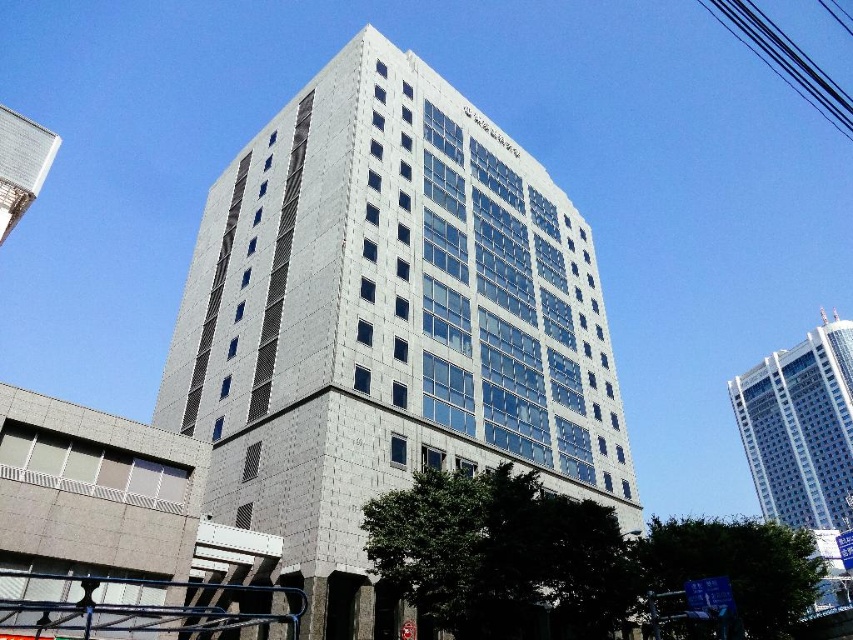
Does white glass building at upper right have a greater width compared to metallic silver tower at upper left?

Yes, white glass building at upper right is wider than metallic silver tower at upper left.

Who is more forward, (834, 358) or (39, 157)?

Point (39, 157)

Locate an element on the screen. This screenshot has height=640, width=853. white glass building at upper right is located at coordinates (804, 442).

Between white glass building at center and metallic silver tower at upper left, which one has more height?

white glass building at center is taller.

Between white glass building at center and metallic silver tower at upper left, which one is positioned lower?

white glass building at center is lower down.

Is point (233, 259) farther from viewer compared to point (38, 163)?

Yes, point (233, 259) is farther from viewer.

Locate an element on the screen. The width and height of the screenshot is (853, 640). white glass building at center is located at coordinates (386, 324).

Find the location of a particular element. The height and width of the screenshot is (640, 853). white glass building at center is located at coordinates (386, 324).

Does white glass building at center have a greater width compared to white glass building at upper right?

In fact, white glass building at center might be narrower than white glass building at upper right.

Does point (274, 483) come farther from viewer compared to point (840, 372)?

No, it is in front of (840, 372).

Find the location of a particular element. white glass building at center is located at coordinates (386, 324).